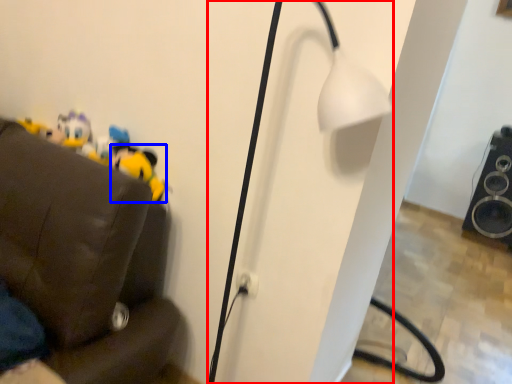
Question: Among these objects, which one is nearest to the camera, lamp (highlighted by a red box) or toy (highlighted by a blue box)?

Choices:
 (A) lamp
 (B) toy

Answer: (A)